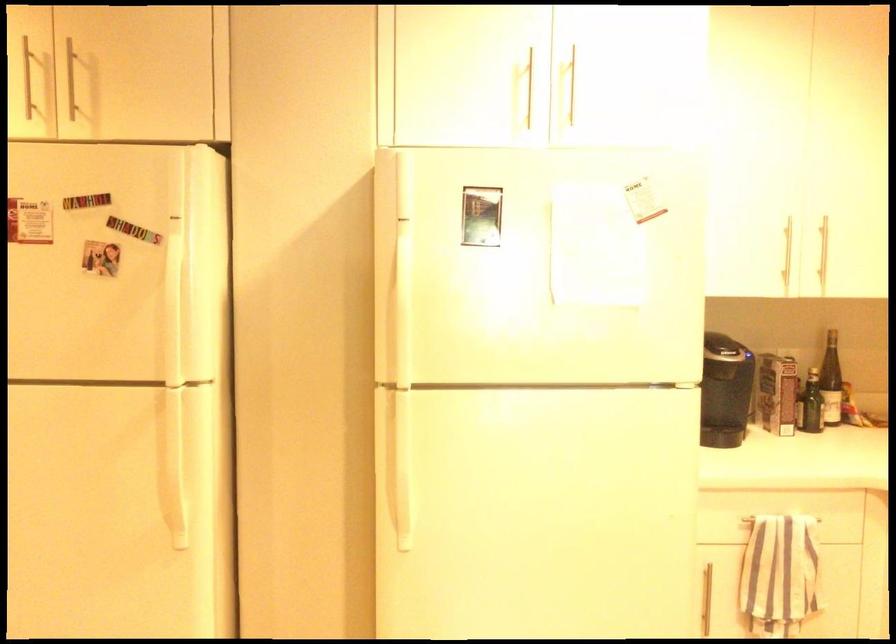
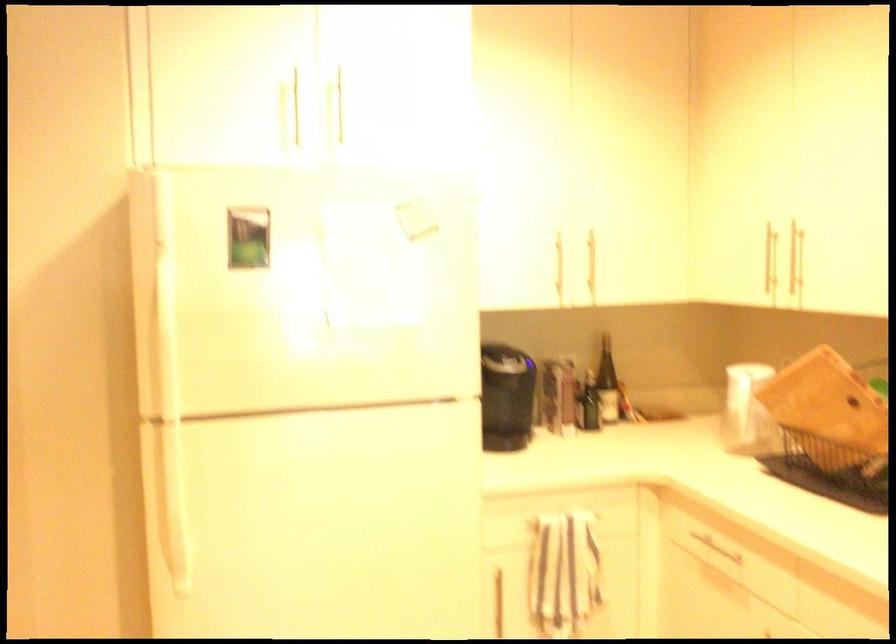
Question: The camera is either moving clockwise (left) or counter-clockwise (right) around the object. The first image is from the beginning of the video and the second image is from the end. Is the camera moving left or right when shooting the video?

Choices:
 (A) Left
 (B) Right

Answer: (A)